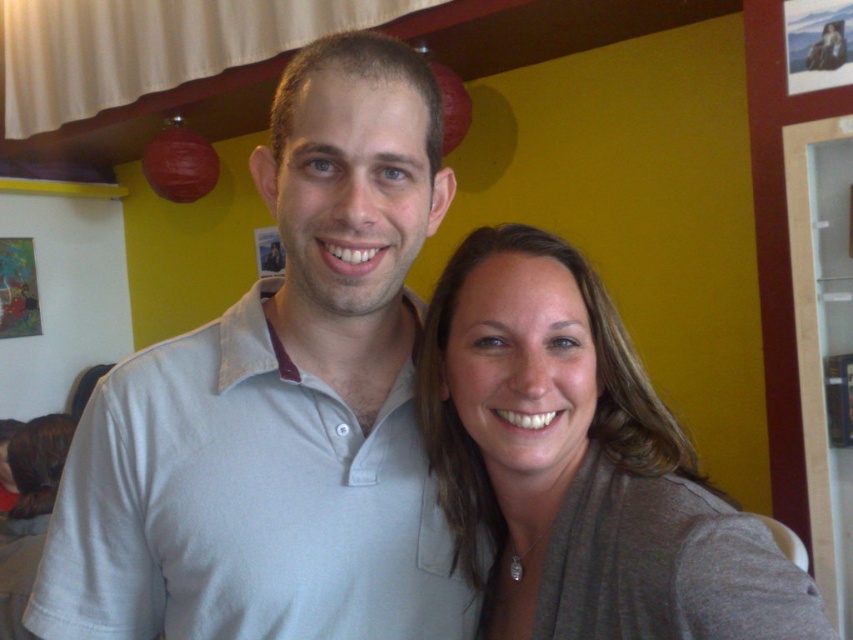
You are a fashion designer observing the scene. You need to determine which item is visible on top between the light gray cotton polo shirt at center and the matte gray scarf at right. Which one is on top?

The light gray cotton polo shirt at center is positioned over the matte gray scarf at right, so the light gray cotton polo shirt at center is on top.

You are a photographer trying to capture the scene of two people taking a selfie in a cafe. You notice the light gray cotton polo shirt at center and the matte gray scarf at right. Which clothing item is positioned more to the left in the image?

The light gray cotton polo shirt at center is positioned more to the left than the matte gray scarf at right.

You are standing in a cafe and want to take a selfie with your friend. You notice a specific point in the scene at coordinates point (x=119, y=580). If you want to ensure that both you and your friend are fully visible in the photo, should you move closer to or farther away from this point?

Since the point (x=119, y=580) is 33.24 inches away from the viewer, you should move closer to this point to ensure both you and your friend are fully visible in the photo. Moving closer reduces the distance, allowing the camera to capture more of the scene.